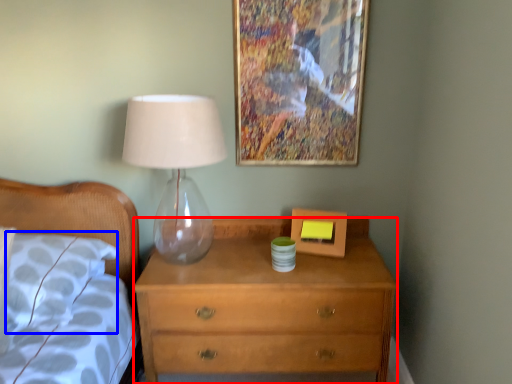
Question: Which of the following is the closest to the observer, chest of drawers (highlighted by a red box) or pillow (highlighted by a blue box)?

Choices:
 (A) chest of drawers
 (B) pillow

Answer: (B)